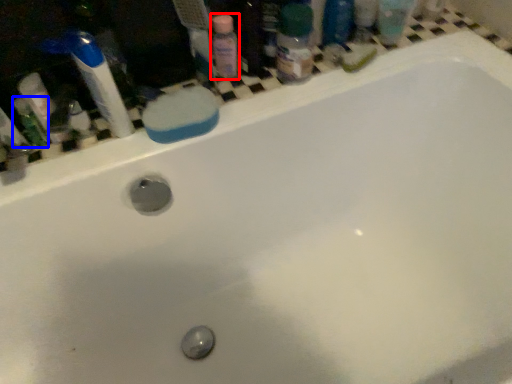
Question: Which of the following is the farthest to the observer, cleaning product (highlighted by a red box) or mouthwash (highlighted by a blue box)?

Choices:
 (A) cleaning product
 (B) mouthwash

Answer: (A)